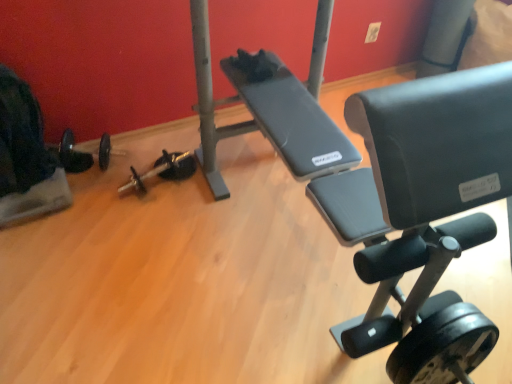
Locate an element on the screen. black rubber dumbbell at lower left, the 2th dumbbell from the front is located at coordinates (x=164, y=170).

Image resolution: width=512 pixels, height=384 pixels. What do you see at coordinates (176, 166) in the screenshot?
I see `black rubber dumbbell at center, which is the 1th dumbbell in back-to-front order` at bounding box center [176, 166].

What are the coordinates of `white matte pole at upper right` in the screenshot? It's located at (445, 37).

Locate an element on the screen. The width and height of the screenshot is (512, 384). black rubber dumbbell at lower right, the third dumbbell positioned from the top is located at coordinates (443, 347).

This screenshot has width=512, height=384. In order to click on dumbbell above the black rubber barbell at lower left (from a real-world perspective) in this screenshot , I will do `click(443, 347)`.

Can you confirm if black rubber dumbbell at lower right, which is the first dumbbell from front to back, is wider than black rubber barbell at lower left?

No.

Can you confirm if black rubber dumbbell at lower right, acting as the first dumbbell starting from the bottom, is taller than black rubber barbell at lower left?

Yes, black rubber dumbbell at lower right, acting as the first dumbbell starting from the bottom, is taller than black rubber barbell at lower left.

How distant is black rubber dumbbell at lower right, arranged as the 1th dumbbell when viewed from the right, from black rubber barbell at lower left?

black rubber dumbbell at lower right, arranged as the 1th dumbbell when viewed from the right, is 5.24 feet from black rubber barbell at lower left.

This screenshot has height=384, width=512. What are the coordinates of `barbell behind the black rubber dumbbell at lower left, placed as the second dumbbell when sorted from top to bottom` in the screenshot? It's located at (72, 154).

In the image, is black rubber barbell at lower left on the left side or the right side of black rubber dumbbell at lower left, marked as the first dumbbell in a left-to-right arrangement?

Based on their positions, black rubber barbell at lower left is located to the left of black rubber dumbbell at lower left, marked as the first dumbbell in a left-to-right arrangement.

Is black rubber barbell at lower left oriented towards black rubber dumbbell at lower left, placed as the second dumbbell when sorted from top to bottom?

No, black rubber barbell at lower left does not turn towards black rubber dumbbell at lower left, placed as the second dumbbell when sorted from top to bottom.

Is point (60, 158) positioned behind point (140, 193)?

Yes.

Could you measure the distance between black rubber dumbbell at center, positioned as the third dumbbell in bottom-to-top order, and black rubber dumbbell at lower right, the 3th dumbbell when ordered from back to front?

black rubber dumbbell at center, positioned as the third dumbbell in bottom-to-top order, and black rubber dumbbell at lower right, the 3th dumbbell when ordered from back to front, are 1.27 meters apart.

Considering the sizes of black rubber dumbbell at center, which is the first dumbbell in top-to-bottom order, and black rubber dumbbell at lower right, the third dumbbell viewed from the left, in the image, is black rubber dumbbell at center, which is the first dumbbell in top-to-bottom order, taller or shorter than black rubber dumbbell at lower right, the third dumbbell viewed from the left,?

Clearly, black rubber dumbbell at center, which is the first dumbbell in top-to-bottom order, is shorter compared to black rubber dumbbell at lower right, the third dumbbell viewed from the left.

From a real-world perspective, does black rubber dumbbell at center, which is the 1th dumbbell in back-to-front order, sit lower than black rubber dumbbell at lower right, acting as the first dumbbell starting from the bottom?

Yes.

How many degrees apart are the facing directions of black rubber dumbbell at center, positioned as the 2th dumbbell in right-to-left order, and black rubber dumbbell at lower right, the third dumbbell positioned from the top?

The facing directions of black rubber dumbbell at center, positioned as the 2th dumbbell in right-to-left order, and black rubber dumbbell at lower right, the third dumbbell positioned from the top, are 13.1 degrees apart.

Could you tell me if black rubber barbell at lower left is facing black rubber dumbbell at center, the second dumbbell in the left-to-right sequence?

No, black rubber barbell at lower left is not oriented towards black rubber dumbbell at center, the second dumbbell in the left-to-right sequence.

Find the location of a particular element. dumbbell behind the black rubber barbell at lower left is located at coordinates (176, 166).

Does black rubber barbell at lower left have a larger size compared to black rubber dumbbell at center, marked as the 3th dumbbell in a front-to-back arrangement?

Yes.

Would you say black rubber dumbbell at lower left, arranged as the 2th dumbbell when viewed from the back, is to the left or to the right of black rubber dumbbell at lower right, the 3th dumbbell when ordered from back to front, in the picture?

black rubber dumbbell at lower left, arranged as the 2th dumbbell when viewed from the back, is to the left of black rubber dumbbell at lower right, the 3th dumbbell when ordered from back to front.

Does black rubber dumbbell at lower left, placed as the second dumbbell when sorted from top to bottom, have a greater height compared to black rubber dumbbell at lower right, the third dumbbell viewed from the left?

No.

How many degrees apart are the facing directions of black rubber dumbbell at lower left, arranged as the 2th dumbbell when viewed from the back, and black rubber dumbbell at lower right, the third dumbbell viewed from the left?

The angular difference between black rubber dumbbell at lower left, arranged as the 2th dumbbell when viewed from the back, and black rubber dumbbell at lower right, the third dumbbell viewed from the left, is 10.9 degrees.

From the picture: Which object is more forward, black rubber dumbbell at lower left, the 2th dumbbell from the front, or black rubber dumbbell at lower right, the 3th dumbbell when ordered from back to front?

black rubber dumbbell at lower right, the 3th dumbbell when ordered from back to front, is closer to the camera.

Is black rubber dumbbell at lower right, which is the first dumbbell from front to back, to the left or to the right of black rubber dumbbell at lower left, placed as the second dumbbell when sorted from top to bottom, in the image?

black rubber dumbbell at lower right, which is the first dumbbell from front to back, is positioned on black rubber dumbbell at lower left, placed as the second dumbbell when sorted from top to bottom,'s right side.

Is point (400, 365) farther from camera compared to point (134, 178)?

No, it is not.

Considering the sizes of objects black rubber dumbbell at lower right, which is the first dumbbell from front to back, and black rubber dumbbell at lower left, marked as the first dumbbell in a left-to-right arrangement, in the image provided, who is thinner, black rubber dumbbell at lower right, which is the first dumbbell from front to back, or black rubber dumbbell at lower left, marked as the first dumbbell in a left-to-right arrangement,?

Thinner between the two is black rubber dumbbell at lower right, which is the first dumbbell from front to back.

Is black rubber dumbbell at lower left, placed as the 2th dumbbell when sorted from bottom to top, located within black rubber dumbbell at lower right, the 3th dumbbell when ordered from back to front?

No, black rubber dumbbell at lower left, placed as the 2th dumbbell when sorted from bottom to top, is not a part of black rubber dumbbell at lower right, the 3th dumbbell when ordered from back to front.

Is black rubber dumbbell at lower right, acting as the first dumbbell starting from the bottom, facing away from white matte pole at upper right?

No.

Can you confirm if black rubber dumbbell at lower right, acting as the first dumbbell starting from the bottom, is wider than white matte pole at upper right?

Incorrect, the width of black rubber dumbbell at lower right, acting as the first dumbbell starting from the bottom, does not surpass that of white matte pole at upper right.

In the image, is black rubber dumbbell at lower right, which is the first dumbbell from front to back, positioned in front of or behind white matte pole at upper right?

Visually, black rubber dumbbell at lower right, which is the first dumbbell from front to back, is located in front of white matte pole at upper right.

Measure the distance from black rubber dumbbell at lower right, the 3th dumbbell when ordered from back to front, to white matte pole at upper right.

They are 1.83 meters apart.

Identify the location of barbell on the left of black rubber dumbbell at lower right, arranged as the 1th dumbbell when viewed from the right. (72, 154).

Which dumbbell is the 1st one when counting from the front of the black rubber barbell at lower left? Please provide its 2D coordinates.

[(164, 170)]

When comparing their distances from black rubber dumbbell at center, the second dumbbell in the left-to-right sequence, does black rubber dumbbell at lower left, the 2th dumbbell from the front, or black rubber barbell at lower left seem closer?

black rubber dumbbell at lower left, the 2th dumbbell from the front, lies closer to black rubber dumbbell at center, the second dumbbell in the left-to-right sequence, than the other object.

Considering their positions, is white matte pole at upper right positioned further to black rubber dumbbell at lower left, marked as the first dumbbell in a left-to-right arrangement, than black rubber barbell at lower left?

Based on the image, white matte pole at upper right appears to be further to black rubber dumbbell at lower left, marked as the first dumbbell in a left-to-right arrangement.

From the image, which object appears to be nearer to black rubber dumbbell at lower right, which is the first dumbbell from front to back, black rubber dumbbell at center, which is the first dumbbell in top-to-bottom order, or black rubber dumbbell at lower left, marked as the first dumbbell in a left-to-right arrangement?

black rubber dumbbell at center, which is the first dumbbell in top-to-bottom order, is positioned closer to the anchor black rubber dumbbell at lower right, which is the first dumbbell from front to back.

When comparing their distances from black rubber barbell at lower left, does velvet black swivel chair at left or black rubber dumbbell at lower left, placed as the 2th dumbbell when sorted from bottom to top, seem closer?

The object closer to black rubber barbell at lower left is velvet black swivel chair at left.

Considering their positions, is black rubber dumbbell at lower right, the third dumbbell positioned from the top, positioned closer to black rubber dumbbell at center, positioned as the third dumbbell in bottom-to-top order, than black rubber barbell at lower left?

black rubber barbell at lower left.

Consider the image. From the image, which object appears to be farther from black rubber dumbbell at lower left, placed as the second dumbbell when sorted from top to bottom, black rubber dumbbell at lower right, arranged as the 1th dumbbell when viewed from the right, or velvet black swivel chair at left?

Among the two, black rubber dumbbell at lower right, arranged as the 1th dumbbell when viewed from the right, is located further to black rubber dumbbell at lower left, placed as the second dumbbell when sorted from top to bottom.

Estimate the real-world distances between objects in this image. Which object is closer to velvet black swivel chair at left, black rubber dumbbell at lower right, the third dumbbell positioned from the top, or black rubber dumbbell at lower left, the third dumbbell from the right?

black rubber dumbbell at lower left, the third dumbbell from the right, is closer to velvet black swivel chair at left.

Based on the photo, which object lies further to the anchor point velvet black swivel chair at left, black rubber dumbbell at lower right, which is the first dumbbell from front to back, or black rubber dumbbell at center, marked as the 3th dumbbell in a front-to-back arrangement?

black rubber dumbbell at lower right, which is the first dumbbell from front to back, is further to velvet black swivel chair at left.

Find the location of a particular element. barbell located between velvet black swivel chair at left and black rubber dumbbell at center, the second dumbbell in the left-to-right sequence, in the left-right direction is located at coordinates (72, 154).

This screenshot has width=512, height=384. I want to click on barbell between velvet black swivel chair at left and black rubber dumbbell at lower right, arranged as the 1th dumbbell when viewed from the right, from left to right, so click(x=72, y=154).

The image size is (512, 384). I want to click on barbell situated between velvet black swivel chair at left and black rubber dumbbell at lower left, placed as the second dumbbell when sorted from top to bottom, from left to right, so click(72, 154).

You are a GUI agent. You are given a task and a screenshot of the screen. Output one action in this format:
    pyautogui.click(x=<x>, y=<y>)
    Task: Click on the dumbbell between velvet black swivel chair at left and black rubber dumbbell at center, positioned as the 2th dumbbell in right-to-left order, from left to right
    This screenshot has width=512, height=384.
    Given the screenshot: What is the action you would take?
    pyautogui.click(x=164, y=170)